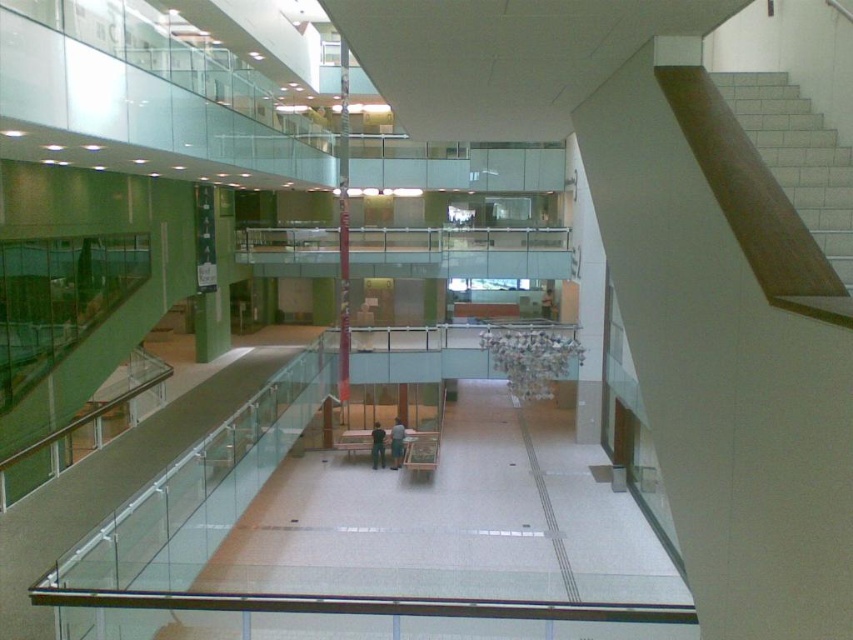
You are standing at the entrance of the building and want to go to the upper floor. You see the clear glass balustrade at center and the white tile stairs at upper right. Which direction should you go to reach the upper floor?

The white tile stairs at upper right lead upwards, so you should go towards the white tile stairs at upper right to reach the upper floor.

You are a delivery person carrying a large box that is 1.5 meters wide. You need to move from the lower level to the upper level. The path requires passing through the clear glass balustrade at center and the white tile stairs at upper right. Can your box fit through the narrowest part of this path?

The clear glass balustrade at center might be wider than white tile stairs at upper right. Since the white tile stairs at upper right is narrower, your box that is 1.5 meters wide may not fit if the narrowest part is narrower than 1.5 meters. Check the width of the white tile stairs at upper right before proceeding.